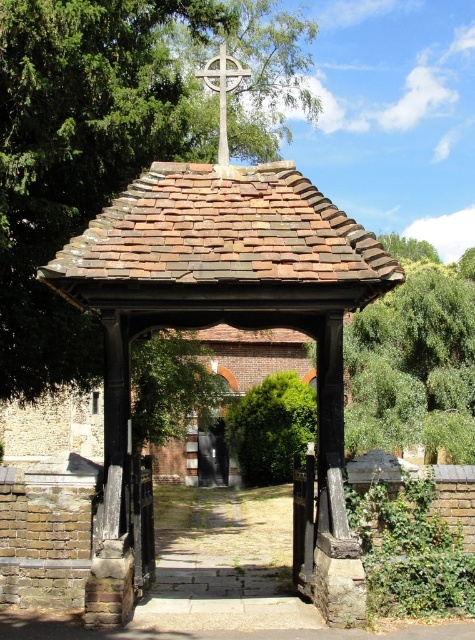
You are standing at the entrance of the churchyard and want to take a photo of the white stone cross at upper center. However, the green leafy tree at center is blocking your view. Can you estimate if the tree is taller than the cross?

The green leafy tree at center is much taller than the white stone cross at upper center, so it would likely block the view of the cross.

You are standing at the entrance of the churchyard and see the brown tiled gazebo at center and the green leafy tree at center. Which object is located directly above the other?

The green leafy tree at center is directly above the brown tiled gazebo at center because the gazebo is positioned under the tree.